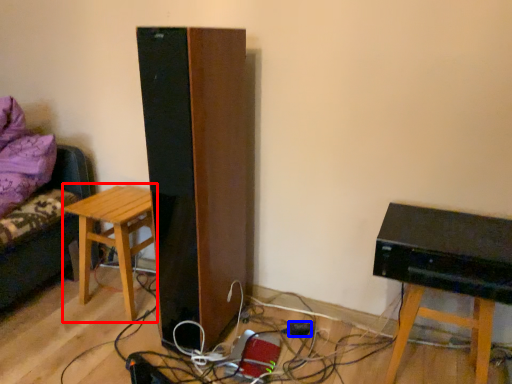
Question: Which object appears farthest to the camera in this image, stool (highlighted by a red box) or plug (highlighted by a blue box)?

Choices:
 (A) stool
 (B) plug

Answer: (B)